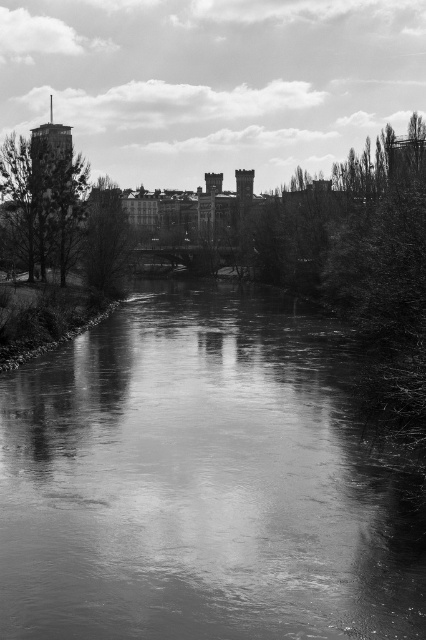
You are an artist trying to sketch this riverside scene. You need to place the smooth water at center and the dark green leafy tree at center accurately. According to the image, which object is located to the right of the other?

The smooth water at center is positioned on the right side of dark green leafy tree at center.